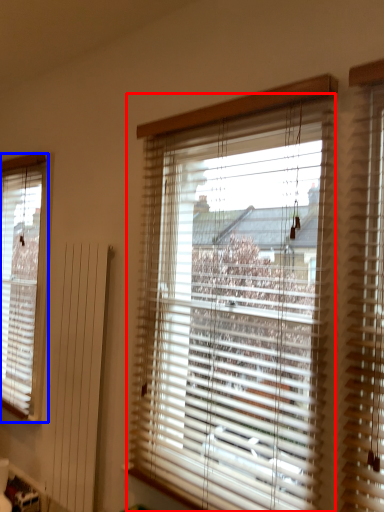
Question: Which of the following is the closest to the observer, window blind (highlighted by a red box) or window blind (highlighted by a blue box)?

Choices:
 (A) window blind
 (B) window blind

Answer: (A)